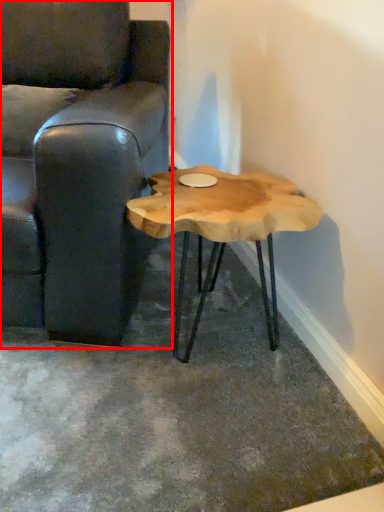
Question: Considering the relative positions of chair (annotated by the red box) and coffee table in the image provided, where is chair (annotated by the red box) located with respect to the staircase?

Choices:
 (A) right
 (B) left

Answer: (B)